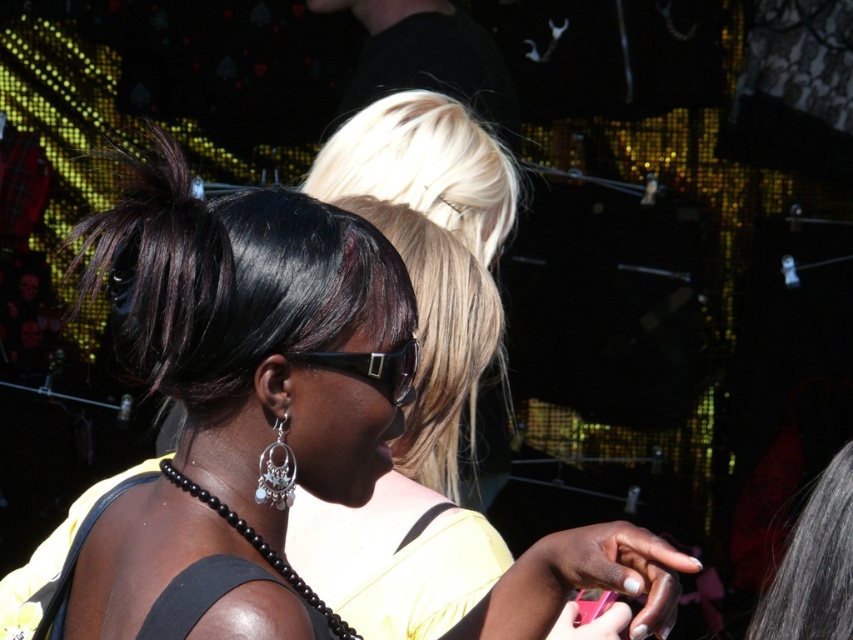
Question: Among these points, which one is nearest to the camera?

Choices:
 (A) (184, 218)
 (B) (349, 358)
 (C) (259, 465)

Answer: (B)

Question: Does black plastic sunglasses at center have a larger size compared to pink plastic smartphone at lower right?

Choices:
 (A) no
 (B) yes

Answer: (A)

Question: Estimate the real-world distances between objects in this image. Which object is closer to the gray silky hair at upper right?

Choices:
 (A) pink plastic smartphone at lower right
 (B) silver metallic dangling earring at center
 (C) matte black hair at center

Answer: (A)

Question: Which is farther from the gray silky hair at upper right?

Choices:
 (A) black plastic sunglasses at center
 (B) matte black hair at center
 (C) pink plastic smartphone at lower right

Answer: (B)

Question: Can you confirm if matte black hair at center is positioned above pink plastic smartphone at lower right?

Choices:
 (A) yes
 (B) no

Answer: (A)

Question: Is gray silky hair at upper right bigger than black plastic sunglasses at center?

Choices:
 (A) yes
 (B) no

Answer: (A)